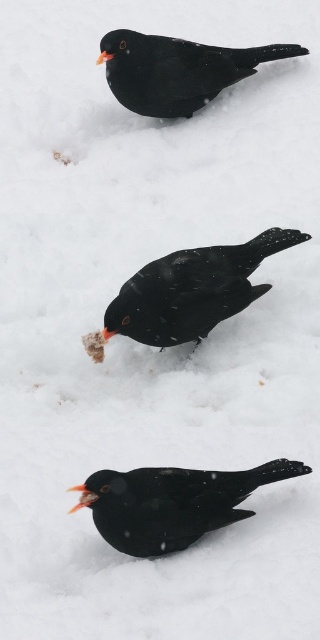
Question: Considering the relative positions of shiny black bird at center and matte black bird at center in the image provided, where is shiny black bird at center located with respect to matte black bird at center?

Choices:
 (A) above
 (B) below

Answer: (B)

Question: Is matte black bird at center below shiny black crow at upper center?

Choices:
 (A) no
 (B) yes

Answer: (B)

Question: Which object is farther from the camera taking this photo?

Choices:
 (A) shiny black bird at center
 (B) shiny black crow at upper center

Answer: (B)

Question: Is shiny black bird at center smaller than shiny black crow at upper center?

Choices:
 (A) yes
 (B) no

Answer: (A)

Question: Which point appears closest to the camera in this image?

Choices:
 (A) (165, 278)
 (B) (163, 58)

Answer: (A)

Question: Which object is positioned farthest from the shiny black bird at center?

Choices:
 (A) matte black bird at center
 (B) shiny black crow at upper center

Answer: (B)